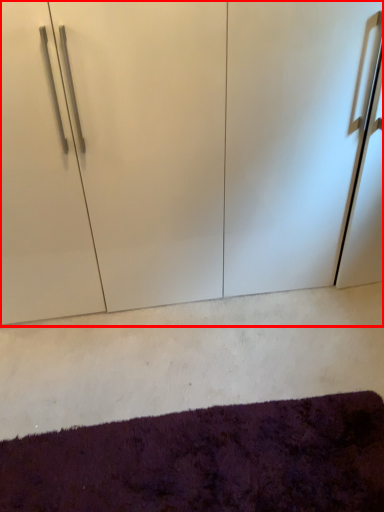
Question: In this image, where is cupboard (annotated by the red box) located relative to mat?

Choices:
 (A) left
 (B) right

Answer: (B)